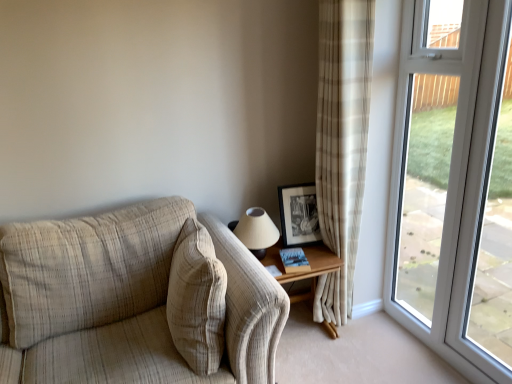
Identify the location of free point below wooden table at right (from a real-world perspective). (300, 329).